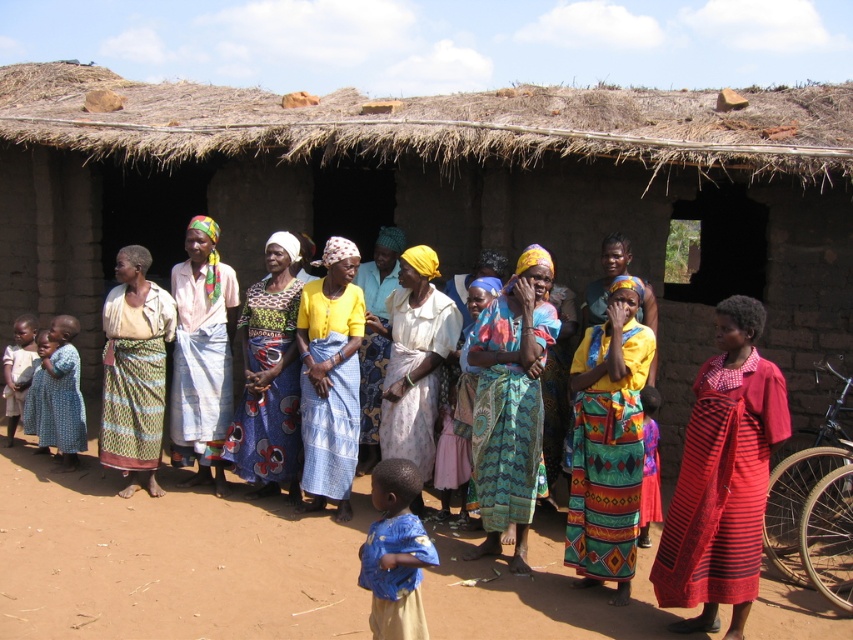
Question: Can you confirm if multicolored woven cloth at center is positioned below green patterned skirt at center?

Choices:
 (A) no
 (B) yes

Answer: (B)

Question: Which point is farther to the camera?

Choices:
 (A) blue cotton dress at lower left
 (B) red striped fabric at center
 (C) printed cotton dress at center
 (D) multicolored woven cloth at center

Answer: (A)

Question: Which is nearer to the red striped fabric at center?

Choices:
 (A) printed cotton dress at center
 (B) blue fabric at center
 (C) green patterned skirt at center

Answer: (B)

Question: Is white cotton dress at center smaller than blue cotton dress at lower left?

Choices:
 (A) no
 (B) yes

Answer: (A)

Question: Which of the following is the farthest from the observer?

Choices:
 (A) click(x=47, y=397)
 (B) click(x=285, y=461)

Answer: (A)

Question: Does red striped fabric at center appear under yellow fabric dress at center?

Choices:
 (A) no
 (B) yes

Answer: (B)